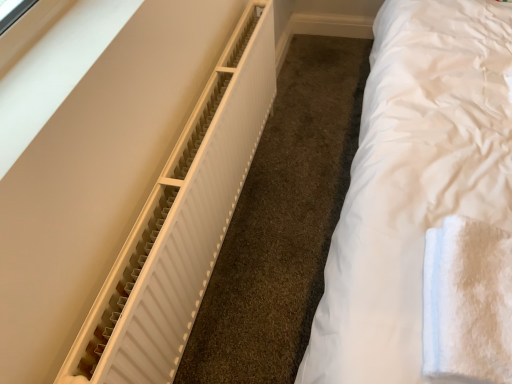
Identify the location of white matte radiator at left. Image resolution: width=512 pixels, height=384 pixels. (181, 222).

What is the approximate width of white matte radiator at left?

The width of white matte radiator at left is 9.46 centimeters.

The image size is (512, 384). What do you see at coordinates (181, 222) in the screenshot?
I see `white matte radiator at left` at bounding box center [181, 222].

What do you see at coordinates (467, 301) in the screenshot?
I see `white fluffy towel at right` at bounding box center [467, 301].

Where is `white fluffy towel at right`? The width and height of the screenshot is (512, 384). white fluffy towel at right is located at coordinates (467, 301).

This screenshot has width=512, height=384. I want to click on white matte radiator at left, so click(181, 222).

Visually, is white matte radiator at left positioned to the left or to the right of white fluffy towel at right?

Clearly, white matte radiator at left is on the left of white fluffy towel at right in the image.

Considering the positions of objects white matte radiator at left and white fluffy towel at right in the image provided, who is in front, white matte radiator at left or white fluffy towel at right?

white fluffy towel at right.

Which is closer, (251, 156) or (431, 373)?

The point (431, 373) is closer to the camera.

Looking at this image, from the image's perspective, between white matte radiator at left and white fluffy towel at right, who is located below?

white fluffy towel at right.

From a real-world perspective, does white matte radiator at left sit lower than white fluffy towel at right?

Correct, in the physical world, white matte radiator at left is lower than white fluffy towel at right.

Which of these two, white matte radiator at left or white fluffy towel at right, is thinner?

white matte radiator at left is thinner.

Which of these two, white matte radiator at left or white fluffy towel at right, stands taller?

white matte radiator at left is taller.

Between white matte radiator at left and white fluffy towel at right, which one has smaller size?

Smaller between the two is white fluffy towel at right.

Is white fluffy towel at right located within white matte radiator at left?

No.

Is white matte radiator at left in contact with white fluffy towel at right?

No.

Is white matte radiator at left aimed at white fluffy towel at right?

Yes, white matte radiator at left is facing white fluffy towel at right.

What's the angular difference between white matte radiator at left and white fluffy towel at right's facing directions?

90.7 degrees.

You are a GUI agent. You are given a task and a screenshot of the screen. Output one action in this format:
    pyautogui.click(x=<x>, y=<y>)
    Task: Click on the cloth on the right side of white matte radiator at left
    This screenshot has height=384, width=512.
    Given the screenshot: What is the action you would take?
    pyautogui.click(x=467, y=301)

Based on their positions, is white fluffy towel at right located to the left or right of white matte radiator at left?

white fluffy towel at right is positioned on white matte radiator at left's right side.

Does white fluffy towel at right come behind white matte radiator at left?

No, white fluffy towel at right is closer to the viewer.

Which is farther from the camera, (490, 378) or (199, 267)?

The point (199, 267) is behind.

From the image's perspective, is white fluffy towel at right over white matte radiator at left?

Actually, white fluffy towel at right appears below white matte radiator at left in the image.

From a real-world perspective, which is physically above, white fluffy towel at right or white matte radiator at left?

white fluffy towel at right, from a real-world perspective.

From the picture: Which of these two, white fluffy towel at right or white matte radiator at left, is wider?

white fluffy towel at right is wider.

Can you confirm if white fluffy towel at right is shorter than white matte radiator at left?

Yes.

Based on the photo, between white fluffy towel at right and white matte radiator at left, which one has smaller size?

With smaller size is white fluffy towel at right.

Is white fluffy towel at right inside or outside of white matte radiator at left?

The correct answer is: outside.

Is white fluffy towel at right not close to white matte radiator at left?

Actually, white fluffy towel at right and white matte radiator at left are a little close together.

Is white fluffy towel at right turned away from white matte radiator at left?

No, white fluffy towel at right is not facing the opposite direction of white matte radiator at left.

How different are the orientations of white fluffy towel at right and white matte radiator at left in degrees?

90.7 degrees.

At what (x,y) coordinates should I click in order to perform the action: click on radiator that appears below the white fluffy towel at right (from a real-world perspective). Please return your answer as a coordinate pair (x, y). This screenshot has width=512, height=384. Looking at the image, I should click on (181, 222).

You are a GUI agent. You are given a task and a screenshot of the screen. Output one action in this format:
    pyautogui.click(x=<x>, y=<y>)
    Task: Click on the radiator behind the white fluffy towel at right
    This screenshot has height=384, width=512.
    Given the screenshot: What is the action you would take?
    pyautogui.click(x=181, y=222)

This screenshot has width=512, height=384. What are the coordinates of `cloth in front of the white matte radiator at left` in the screenshot? It's located at (467, 301).